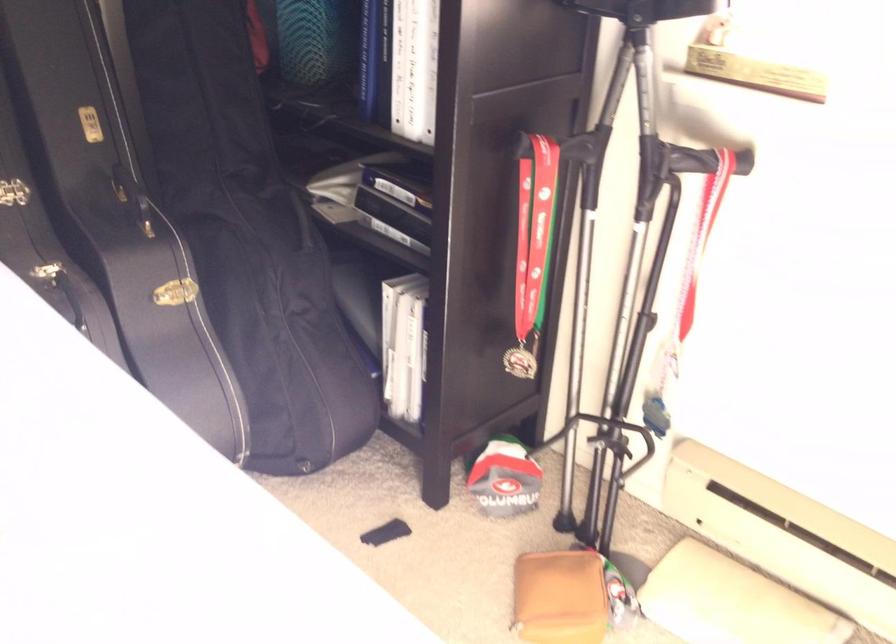
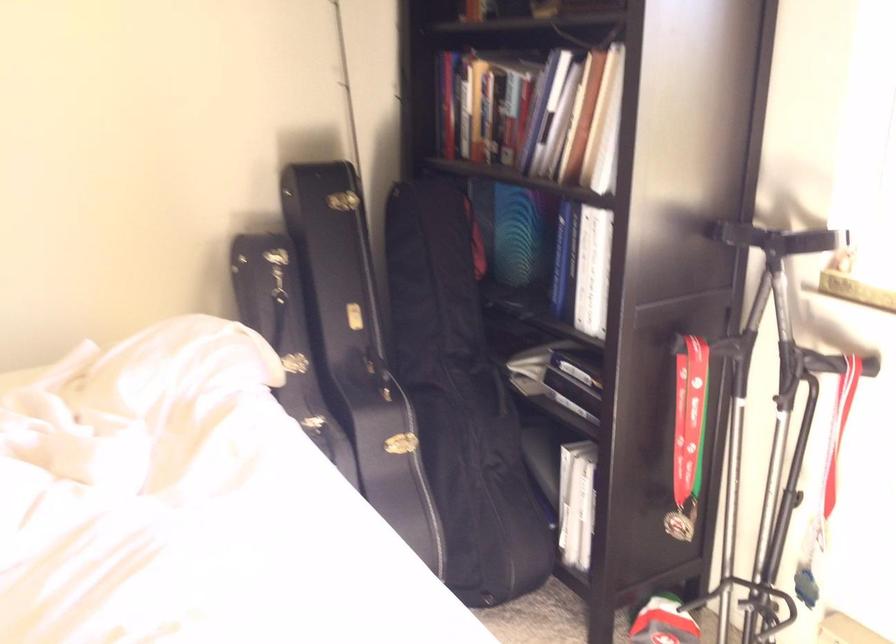
Find the pixel in the second image that matches [703,234] in the first image.

(839, 429)